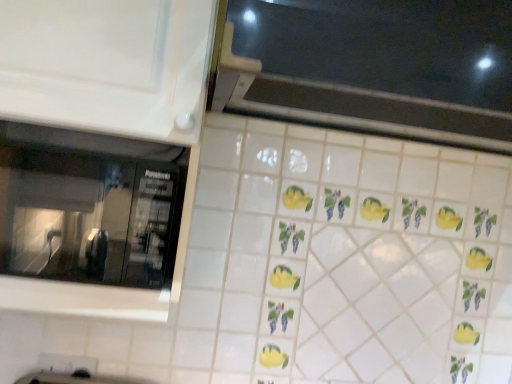
Question: Should I look upward or downward to see black glass window at upper center, marked as the 1th window in a right-to-left arrangement?

Choices:
 (A) down
 (B) up

Answer: (B)

Question: Considering the relative sizes of black glass window at upper center, the 2th window from the left, and transparent glass microwave at left, the first window positioned from the bottom, in the image provided, is black glass window at upper center, the 2th window from the left, bigger than transparent glass microwave at left, the first window positioned from the bottom,?

Choices:
 (A) yes
 (B) no

Answer: (A)

Question: Is black glass window at upper center, the second window from the bottom, surrounding transparent glass microwave at left, the first window positioned from the bottom?

Choices:
 (A) no
 (B) yes

Answer: (A)

Question: Is black glass window at upper center, which ranks as the 1th window in top-to-bottom order, to the left of transparent glass microwave at left, the second window viewed from the top, from the viewer's perspective?

Choices:
 (A) yes
 (B) no

Answer: (B)

Question: Is black glass window at upper center, the 2th window from the left, located outside transparent glass microwave at left, the second window viewed from the top?

Choices:
 (A) no
 (B) yes

Answer: (B)

Question: Is black glass window at upper center, the 2th window from the left, wider than transparent glass microwave at left, arranged as the second window when viewed from the right?

Choices:
 (A) yes
 (B) no

Answer: (A)

Question: Is black glass window at upper center, marked as the 1th window in a right-to-left arrangement, shorter than transparent glass microwave at left, the second window viewed from the top?

Choices:
 (A) yes
 (B) no

Answer: (B)

Question: Are transparent glass microwave at left, the first window positioned from the bottom, and black glass window at upper center, marked as the 1th window in a right-to-left arrangement, making contact?

Choices:
 (A) no
 (B) yes

Answer: (A)

Question: From the image's perspective, would you say transparent glass microwave at left, the first window positioned from the bottom, is shown under black glass window at upper center, which ranks as the 1th window in top-to-bottom order?

Choices:
 (A) no
 (B) yes

Answer: (B)

Question: Can you confirm if transparent glass microwave at left, the first window positioned from the bottom, is positioned to the right of black glass window at upper center, marked as the 1th window in a right-to-left arrangement?

Choices:
 (A) no
 (B) yes

Answer: (A)

Question: Does transparent glass microwave at left, arranged as the second window when viewed from the right, have a greater height compared to black glass window at upper center, the second window from the bottom?

Choices:
 (A) no
 (B) yes

Answer: (A)

Question: Is transparent glass microwave at left, the second window viewed from the top, not inside black glass window at upper center, the second window from the bottom?

Choices:
 (A) yes
 (B) no

Answer: (A)

Question: Is transparent glass microwave at left, the 1th window when ordered from left to right, smaller than black glass window at upper center, the second window from the bottom?

Choices:
 (A) yes
 (B) no

Answer: (A)

Question: Considering the positions of black glass window at upper center, the second window from the bottom, and transparent glass microwave at left, arranged as the second window when viewed from the right, in the image, is black glass window at upper center, the second window from the bottom, taller or shorter than transparent glass microwave at left, arranged as the second window when viewed from the right,?

Choices:
 (A) short
 (B) tall

Answer: (B)